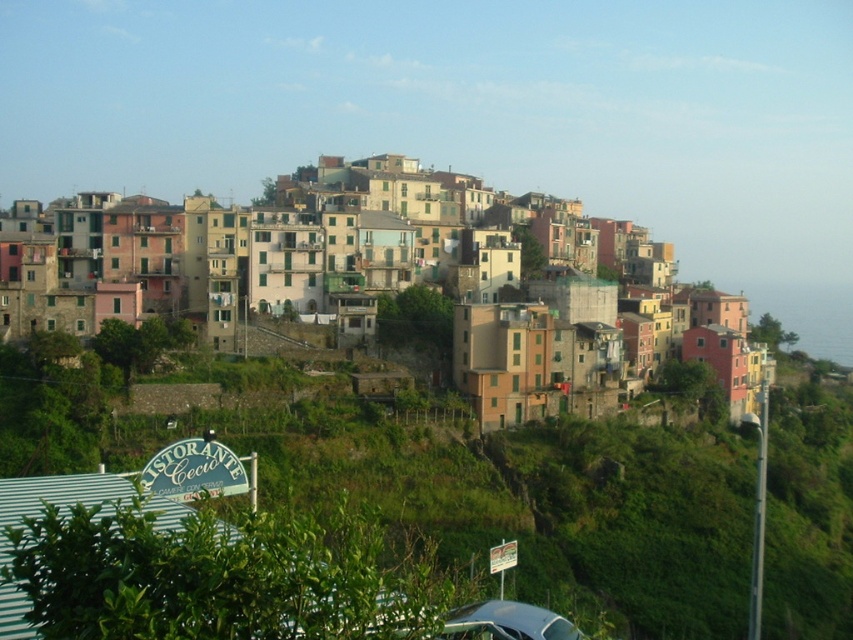
Question: Which of the following is the farthest from the observer?

Choices:
 (A) (503, 228)
 (B) (506, 605)

Answer: (A)

Question: Can you confirm if multicolored stone buildings at center is thinner than metallic silver car at lower center?

Choices:
 (A) yes
 (B) no

Answer: (B)

Question: Does multicolored stone buildings at center appear over metallic silver car at lower center?

Choices:
 (A) no
 (B) yes

Answer: (B)

Question: Which object is closer to the camera taking this photo?

Choices:
 (A) metallic silver car at lower center
 (B) multicolored stone buildings at center

Answer: (A)

Question: Which point is farther to the camera?

Choices:
 (A) multicolored stone buildings at center
 (B) metallic silver car at lower center

Answer: (A)

Question: Can you confirm if multicolored stone buildings at center is positioned to the left of metallic silver car at lower center?

Choices:
 (A) no
 (B) yes

Answer: (B)